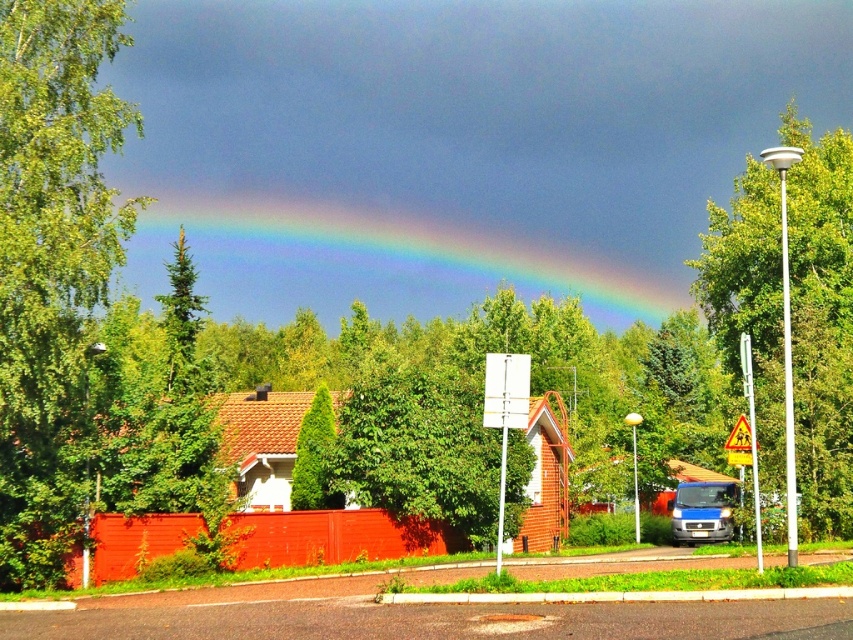
Can you confirm if green leafy tree at left is taller than blue metallic van at lower right?

Correct, green leafy tree at left is much taller as blue metallic van at lower right.

Does green leafy tree at left have a lesser height compared to blue metallic van at lower right?

Incorrect, green leafy tree at left's height does not fall short of blue metallic van at lower right's.

Does point (83, 198) come farther from viewer compared to point (672, 529)?

No, (83, 198) is in front of (672, 529).

I want to click on green leafy tree at left, so click(51, 262).

Does green leafy tree at right have a greater height compared to blue metallic van at lower right?

Correct, green leafy tree at right is much taller as blue metallic van at lower right.

Does green leafy tree at right have a lesser width compared to blue metallic van at lower right?

No.

Is point (811, 522) less distant than point (695, 536)?

Yes.

In order to click on green leafy tree at right in this screenshot , I will do `click(821, 323)`.

Is rainbow at upper center wider than green leafy tree at right?

Yes, rainbow at upper center is wider than green leafy tree at right.

Which is in front, point (346, 269) or point (805, 225)?

Point (805, 225) is more forward.

This screenshot has width=853, height=640. What are the coordinates of `rainbow at upper center` in the screenshot? It's located at (407, 257).

Find the location of a particular element. The width and height of the screenshot is (853, 640). rainbow at upper center is located at coordinates (407, 257).